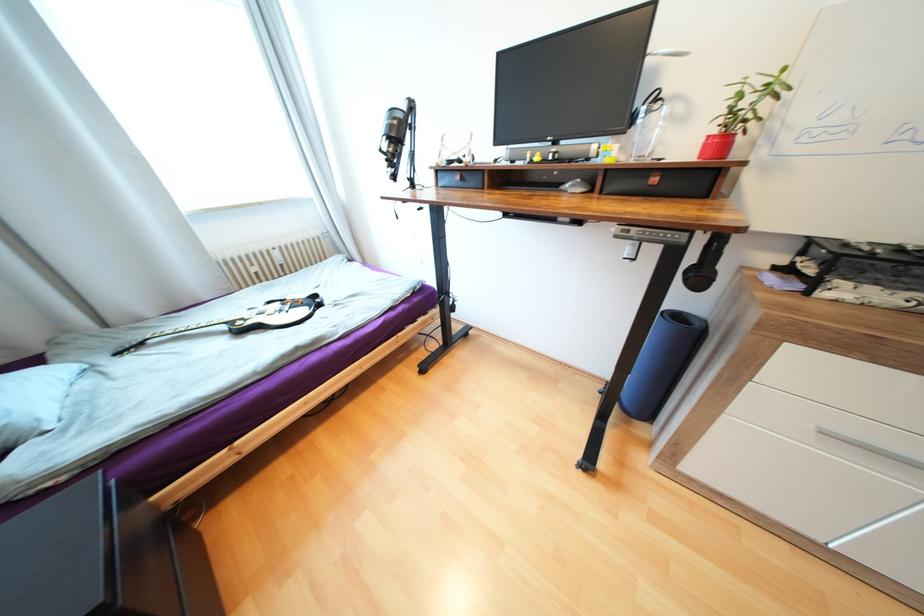
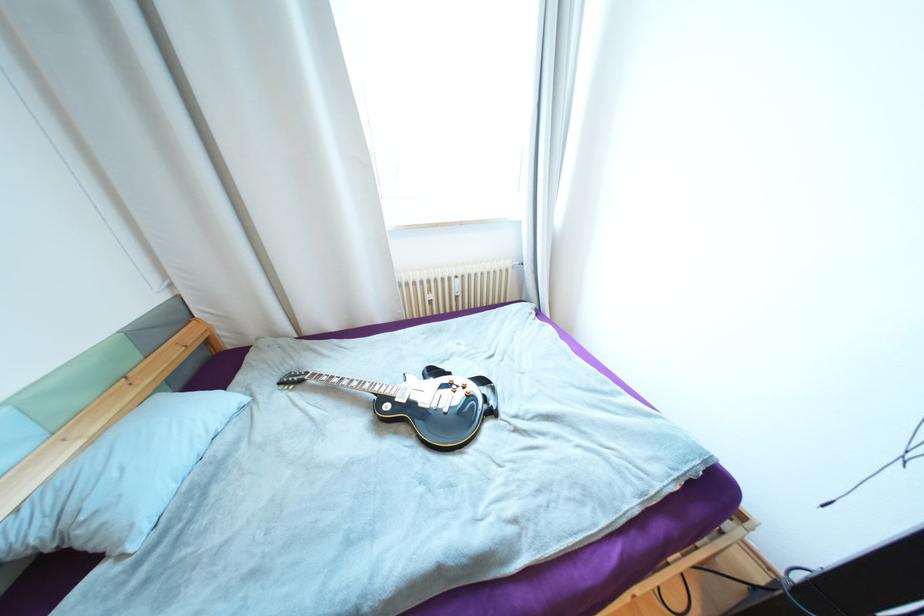
Locate, in the second image, the point that corresponds to the point at 237,318 in the first image.

(387, 391)